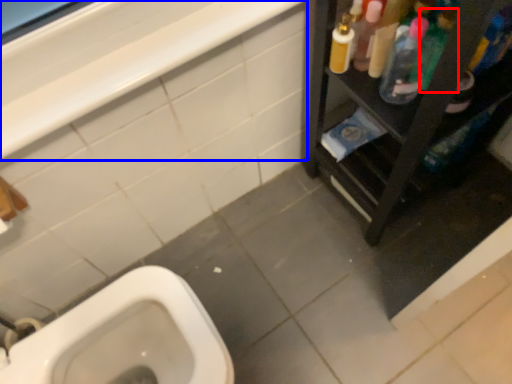
Question: Which object appears farthest to the camera in this image, cleaning product (highlighted by a red box) or balustrade (highlighted by a blue box)?

Choices:
 (A) cleaning product
 (B) balustrade

Answer: (A)